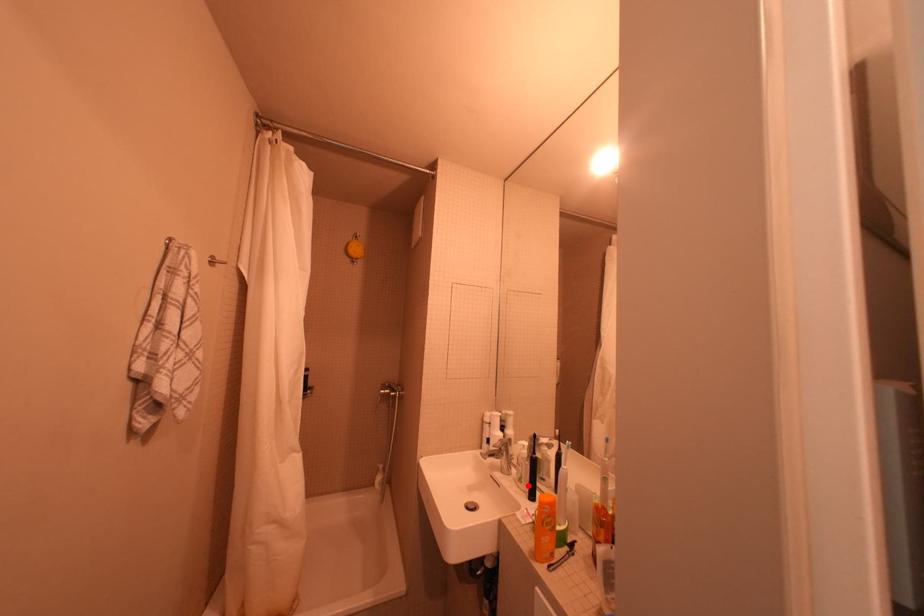
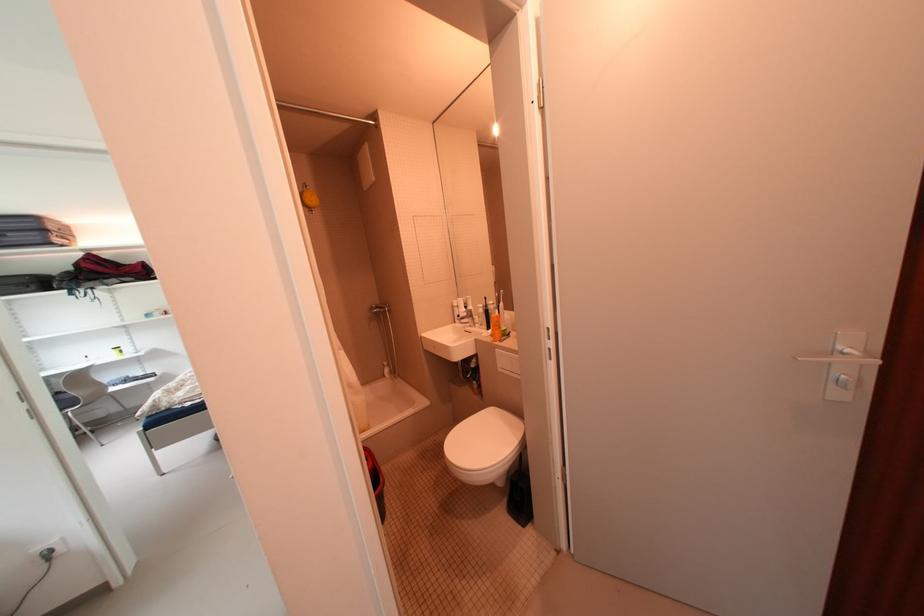
Where in the second image is the point corresponding to the highlighted location from the first image?

(490, 328)